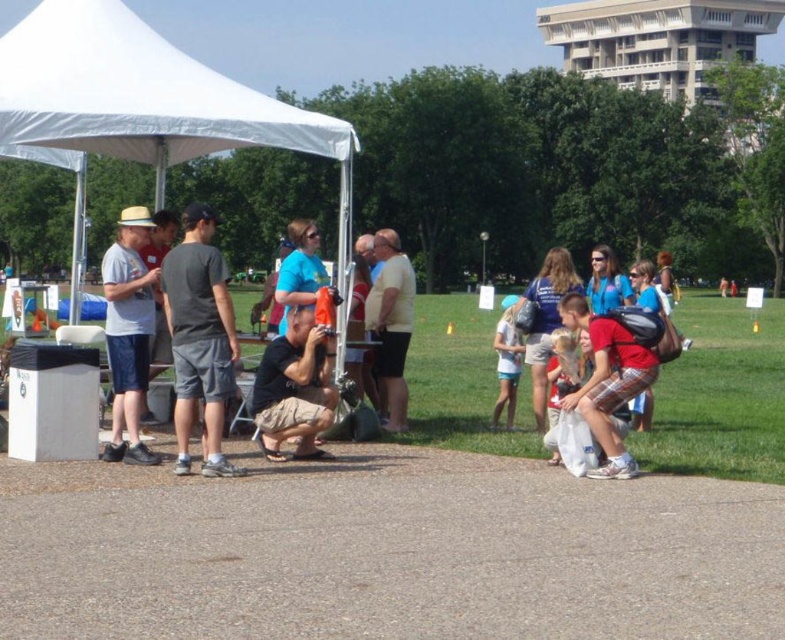
Between white cotton shirt at left and light blue denim shorts at center, which one appears on the left side from the viewer's perspective?

white cotton shirt at left

Does white cotton shirt at left come in front of light blue denim shorts at center?

Yes, it is in front of light blue denim shorts at center.

Is point (110, 273) positioned behind point (510, 364)?

No, (110, 273) is in front of (510, 364).

Locate an element on the screen. The image size is (785, 640). white cotton shirt at left is located at coordinates (128, 332).

This screenshot has width=785, height=640. Describe the element at coordinates (199, 337) in the screenshot. I see `dark gray cotton t-shirt at center` at that location.

Between dark gray cotton t-shirt at center and white cotton shirt at left, which one is positioned lower?

dark gray cotton t-shirt at center

What do you see at coordinates (199, 337) in the screenshot? The width and height of the screenshot is (785, 640). I see `dark gray cotton t-shirt at center` at bounding box center [199, 337].

Locate an element on the screen. dark gray cotton t-shirt at center is located at coordinates (199, 337).

Is point (33, 54) less distant than point (265, 381)?

No, it is not.

Looking at this image, does white fabric tent at upper left have a larger size compared to black cotton t-shirt at center?

Correct, white fabric tent at upper left is larger in size than black cotton t-shirt at center.

Image resolution: width=785 pixels, height=640 pixels. Find the location of `white fabric tent at upper left`. white fabric tent at upper left is located at coordinates (145, 99).